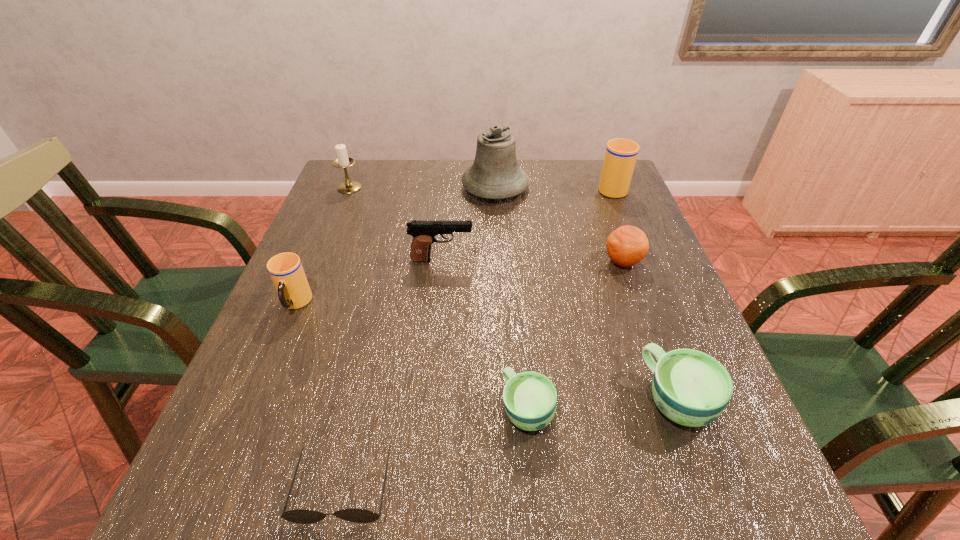
Locate an element on the screen. This screenshot has height=540, width=960. empty location between the nearer beige cup and the bell is located at coordinates (396, 246).

Find the location of a particular element. This screenshot has height=540, width=960. free point between the third cup from right to left and the bell is located at coordinates (512, 298).

The image size is (960, 540). I want to click on empty space between the leftmost cup and the orange orange, so click(459, 283).

Locate an element on the screen. The width and height of the screenshot is (960, 540). empty location between the right blue cup and the farthest cup is located at coordinates click(644, 293).

I want to click on unoccupied position between the white candle holder and the shortest cup, so click(x=439, y=299).

Identify the location of free space between the third tallest cup and the black pistol. This screenshot has height=540, width=960. (559, 329).

You are a GUI agent. You are given a task and a screenshot of the screen. Output one action in this format:
    pyautogui.click(x=<x>, y=<y>)
    Task: Click on the free area in between the tallest object and the right beige cup
    
    Given the screenshot: What is the action you would take?
    pyautogui.click(x=553, y=187)

Find the location of `free space that is in between the orange orange and the black pistol`. free space that is in between the orange orange and the black pistol is located at coordinates (532, 261).

Select which object appears as the seventh closest to the white candle holder. Please provide its 2D coordinates. Your answer should be formatted as a tuple, i.e. [(x, y)], where the tuple contains the x and y coordinates of a point satisfying the conditions above.

[(299, 516)]

Where is `object that ranks as the closest to the orange orange`? This screenshot has height=540, width=960. object that ranks as the closest to the orange orange is located at coordinates (621, 154).